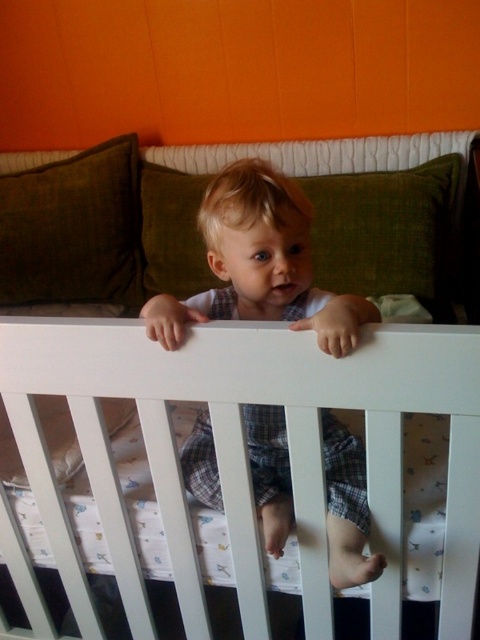
Question: In this image, where is green fabric pillow at upper center located relative to green fabric pillow at upper left?

Choices:
 (A) left
 (B) right

Answer: (B)

Question: Which of these objects is positioned closest to the green fabric pillow at upper left?

Choices:
 (A) plaid fabric toddler at center
 (B) green fabric pillow at upper center

Answer: (B)

Question: From the image, what is the correct spatial relationship of green fabric pillow at upper center in relation to green fabric pillow at upper left?

Choices:
 (A) left
 (B) right

Answer: (B)

Question: Which point appears farthest from the camera in this image?

Choices:
 (A) (0, 284)
 (B) (443, 275)

Answer: (A)

Question: Can you confirm if green fabric pillow at upper center is bigger than green fabric pillow at upper left?

Choices:
 (A) no
 (B) yes

Answer: (A)

Question: Which point is closer to the camera?

Choices:
 (A) plaid fabric toddler at center
 (B) green fabric pillow at upper center
 (C) green fabric pillow at upper left

Answer: (A)